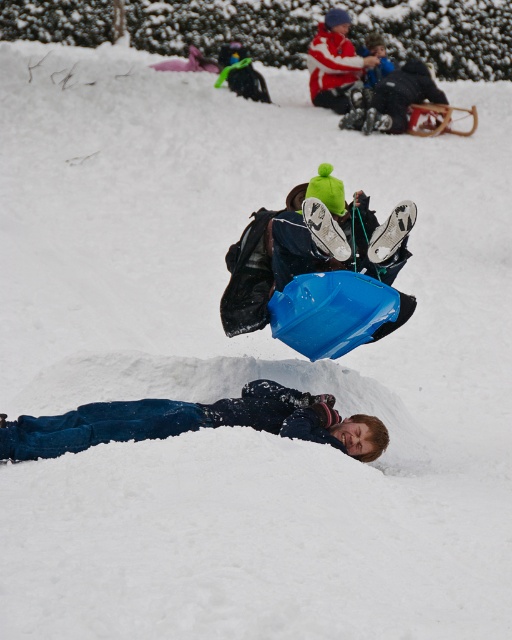
Can you confirm if blue plastic sled at center is wider than dark blue denim pants at lower center?

No, blue plastic sled at center is not wider than dark blue denim pants at lower center.

Based on the photo, is blue plastic sled at center positioned behind dark blue denim pants at lower center?

Yes, blue plastic sled at center is behind dark blue denim pants at lower center.

Find the location of a particular element. This screenshot has height=640, width=512. blue plastic sled at center is located at coordinates (309, 248).

Who is positioned more to the left, blue plastic sled at center or red and white striped sweater at upper center?

Positioned to the left is blue plastic sled at center.

Does blue plastic sled at center have a smaller size compared to red and white striped sweater at upper center?

Yes.

Locate an element on the screen. This screenshot has height=640, width=512. blue plastic sled at center is located at coordinates (309, 248).

Describe the element at coordinates (195, 422) in the screenshot. I see `dark blue denim pants at lower center` at that location.

Who is lower down, dark blue denim pants at lower center or red and white striped sweater at upper center?

dark blue denim pants at lower center

Does point (95, 416) come farther from viewer compared to point (354, 67)?

No, it is in front of (354, 67).

Locate an element on the screen. The image size is (512, 640). dark blue denim pants at lower center is located at coordinates (195, 422).